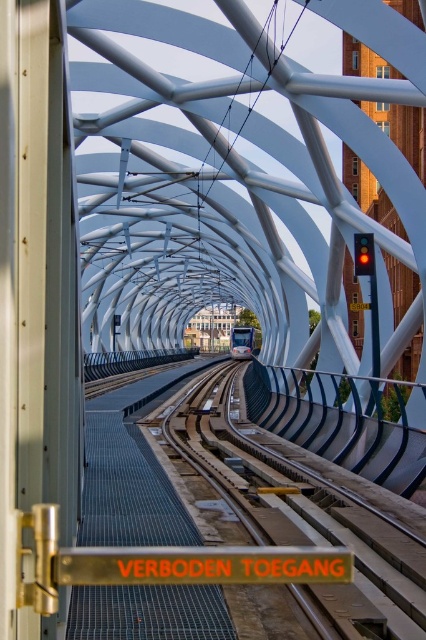
You are a maintenance worker needing to inspect the entire length of the metallic smooth train track at center. You have a measuring tape that can only extend 10 meters. The matte blue train at center is currently parked on top of the track. Can you use the measuring tape to measure the entire length of the track without moving the train?

The metallic smooth train track at center is shorter than the matte blue train at center. Since the train is longer than the track, it would extend beyond the track on both ends, leaving parts of the track exposed. Therefore, you can measure the entire length of the track by measuring from the end of the track that is not covered by the train. However, if the train is centered on the track, you might need to measure from both ends and add the lengths together. The key point is that the track is shorter, so

You are a maintenance worker needing to walk along the platform. The metallic smooth train track at center is in the way. Can you step onto the matte blue train at center to bypass the track?

The metallic smooth train track at center is narrower than the matte blue train at center, so stepping onto the train might be possible, but it is unsafe and not recommended due to the train being in motion.

You are standing on the platform at the train station and see two points marked on the tunnel structure above the tracks. The first point is at coordinates point (388,577) and the second is at point (239,332). Which of these points is closer to your current position?

Point (388,577) is closer to the viewer than point (239,332).